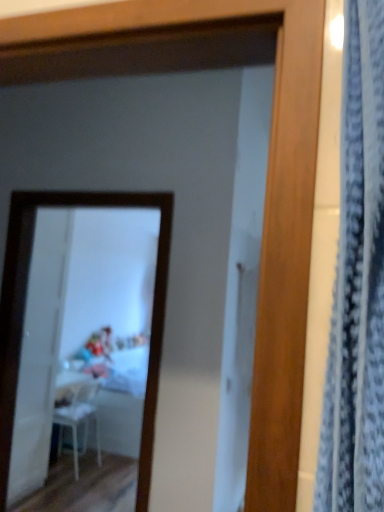
Question: From the image's perspective, is white glossy table at center located above white plastic chair at lower left?

Choices:
 (A) no
 (B) yes

Answer: (A)

Question: Considering the relative positions of white glossy table at center and white plastic chair at lower left in the image provided, is white glossy table at center to the left of white plastic chair at lower left from the viewer's perspective?

Choices:
 (A) yes
 (B) no

Answer: (B)

Question: Is white glossy table at center positioned before white plastic chair at lower left?

Choices:
 (A) yes
 (B) no

Answer: (B)

Question: Is white glossy table at center not close to white plastic chair at lower left?

Choices:
 (A) yes
 (B) no

Answer: (B)

Question: Considering the relative sizes of white glossy table at center and white plastic chair at lower left in the image provided, is white glossy table at center bigger than white plastic chair at lower left?

Choices:
 (A) no
 (B) yes

Answer: (B)

Question: From the image's perspective, is white glossy mirror at upper center located above or below transparent plastic screen door at left?

Choices:
 (A) below
 (B) above

Answer: (B)

Question: Is point (130, 218) positioned closer to the camera than point (51, 270)?

Choices:
 (A) closer
 (B) farther

Answer: (B)

Question: Is white glossy mirror at upper center situated inside transparent plastic screen door at left or outside?

Choices:
 (A) outside
 (B) inside

Answer: (A)

Question: Relative to transparent plastic screen door at left, is white glossy mirror at upper center in front or behind?

Choices:
 (A) behind
 (B) front

Answer: (B)

Question: Looking at the image, does white glossy mirror at upper center seem bigger or smaller compared to white glossy table at center?

Choices:
 (A) small
 (B) big

Answer: (A)

Question: In the image, is white glossy mirror at upper center positioned in front of or behind white glossy table at center?

Choices:
 (A) front
 (B) behind

Answer: (A)

Question: In terms of height, does white glossy mirror at upper center look taller or shorter compared to white glossy table at center?

Choices:
 (A) short
 (B) tall

Answer: (B)

Question: Is point (54, 334) closer or farther from the camera than point (114, 359)?

Choices:
 (A) farther
 (B) closer

Answer: (B)

Question: Visually, is blue textured curtain at right positioned to the left or to the right of white plastic chair at lower left?

Choices:
 (A) left
 (B) right

Answer: (B)

Question: From the image's perspective, is blue textured curtain at right above or below white plastic chair at lower left?

Choices:
 (A) above
 (B) below

Answer: (A)